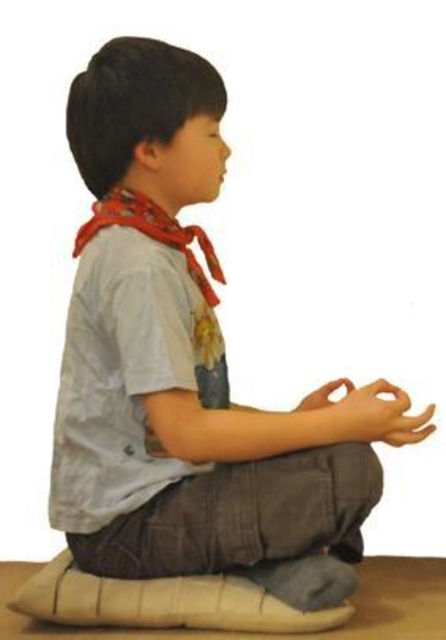
Question: Does red cotton scarf at upper left have a smaller size compared to smooth tan hand at lower right?

Choices:
 (A) yes
 (B) no

Answer: (B)

Question: Is red cotton scarf at upper left thinner than smooth tan hand at lower right?

Choices:
 (A) yes
 (B) no

Answer: (B)

Question: Is red cotton scarf at upper left positioned at the back of smooth tan hand at lower right?

Choices:
 (A) yes
 (B) no

Answer: (A)

Question: Which point is closer to the camera taking this photo?

Choices:
 (A) (401, 428)
 (B) (176, 221)

Answer: (A)